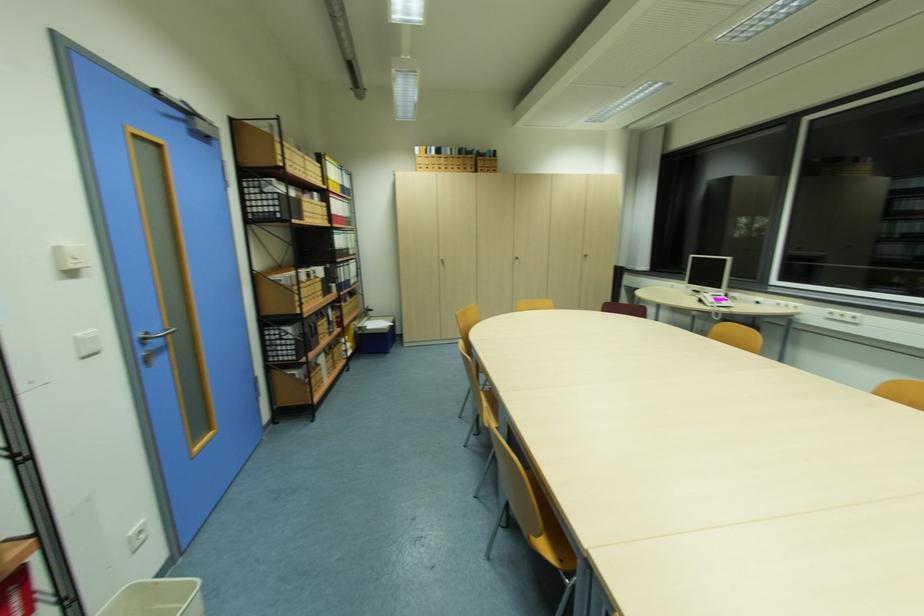
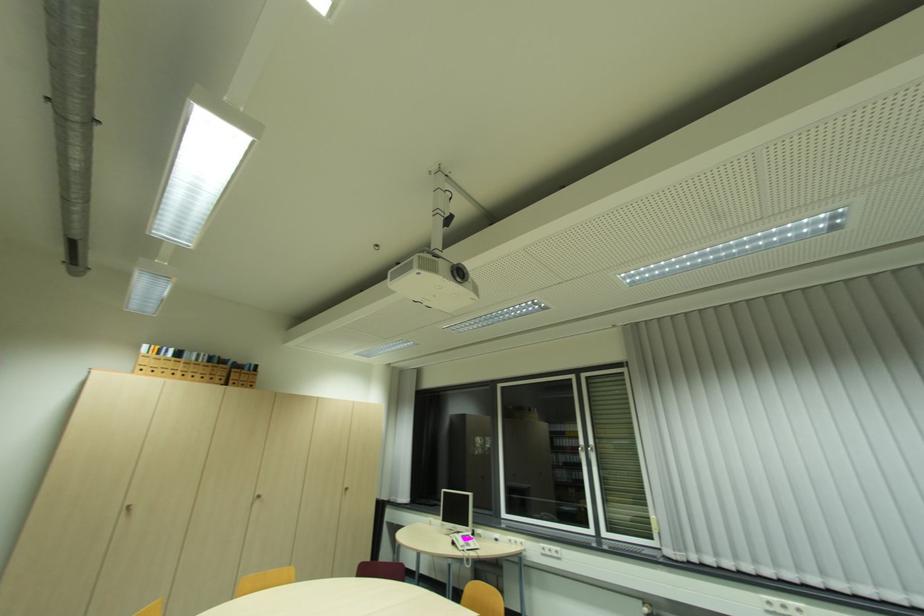
How did the camera likely rotate?

The rotation direction of the camera is right-up.